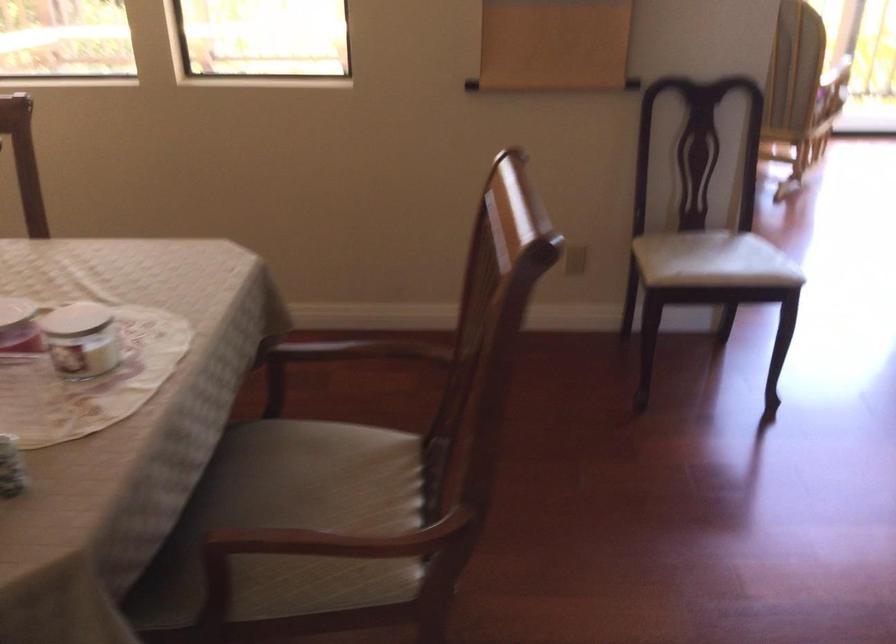
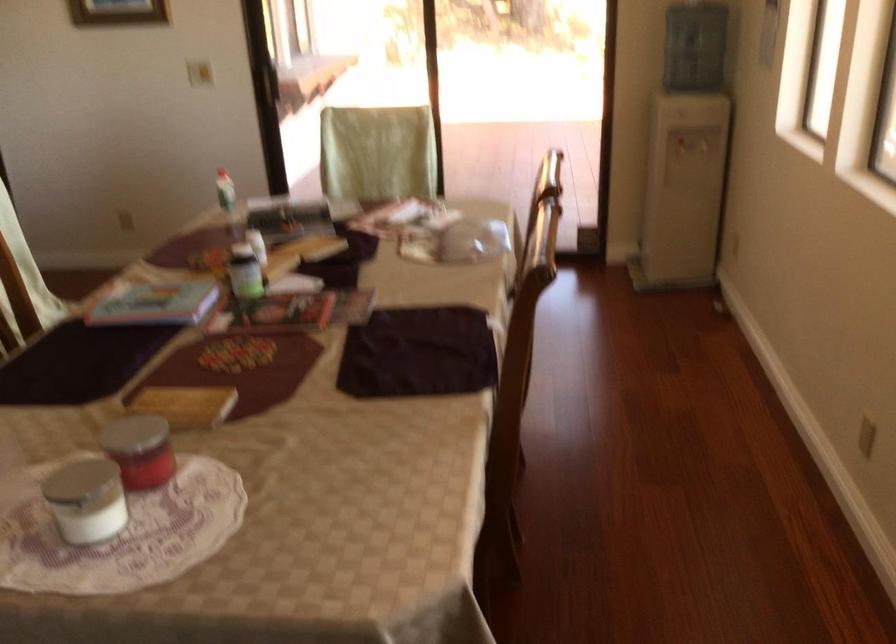
The point at (113, 319) is marked in the first image. Where is the corresponding point in the second image?

(85, 500)